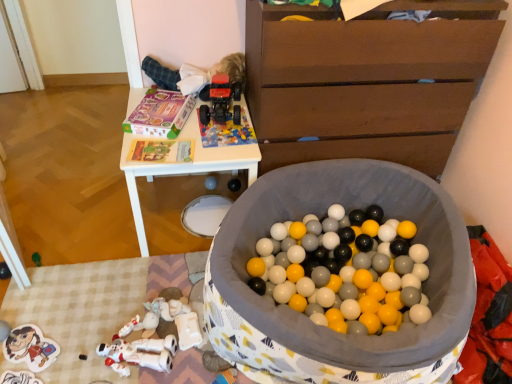
Where is `vacant space behind matte plastic sticker at lower left, which ranks as the 6th toy in right-to-left order`? The height and width of the screenshot is (384, 512). vacant space behind matte plastic sticker at lower left, which ranks as the 6th toy in right-to-left order is located at coordinates (52, 309).